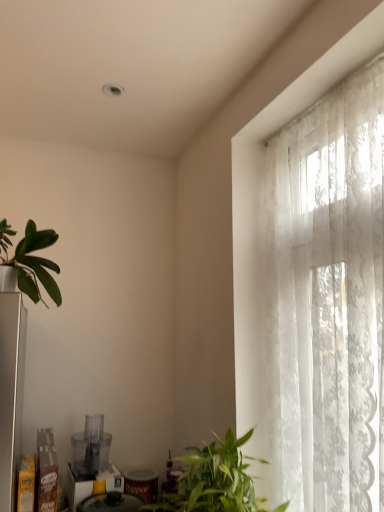
Question: Are matte plastic blender at lower left, which is the second appliance in top-to-bottom order, and transparent plastic food processor at lower left, which appears as the first appliance when viewed from the top, far apart?

Choices:
 (A) no
 (B) yes

Answer: (A)

Question: Can you confirm if matte plastic blender at lower left, which is the second appliance in top-to-bottom order, is wider than transparent plastic food processor at lower left, which is the 2th appliance in bottom-to-top order?

Choices:
 (A) no
 (B) yes

Answer: (B)

Question: Considering the relative positions of matte plastic blender at lower left, which is the second appliance in top-to-bottom order, and transparent plastic food processor at lower left, which is the 2th appliance in bottom-to-top order, in the image provided, is matte plastic blender at lower left, which is the second appliance in top-to-bottom order, behind transparent plastic food processor at lower left, which is the 2th appliance in bottom-to-top order,?

Choices:
 (A) yes
 (B) no

Answer: (B)

Question: From the image's perspective, does matte plastic blender at lower left, which is the second appliance in top-to-bottom order, appear lower than transparent plastic food processor at lower left, which appears as the first appliance when viewed from the top?

Choices:
 (A) no
 (B) yes

Answer: (B)

Question: Does matte plastic blender at lower left, the first appliance when ordered from bottom to top, have a lesser height compared to transparent plastic food processor at lower left, which is the 2th appliance in bottom-to-top order?

Choices:
 (A) no
 (B) yes

Answer: (B)

Question: Is matte plastic blender at lower left, the first appliance when ordered from bottom to top, outside transparent plastic food processor at lower left, which appears as the first appliance when viewed from the top?

Choices:
 (A) yes
 (B) no

Answer: (A)

Question: Considering the relative sizes of transparent plastic food processor at lower left, which appears as the first appliance when viewed from the top, and matte plastic blender at lower left, the first appliance when ordered from bottom to top, in the image provided, is transparent plastic food processor at lower left, which appears as the first appliance when viewed from the top, thinner than matte plastic blender at lower left, the first appliance when ordered from bottom to top,?

Choices:
 (A) yes
 (B) no

Answer: (A)

Question: Is transparent plastic food processor at lower left, which appears as the first appliance when viewed from the top, closer to camera compared to matte plastic blender at lower left, which is the second appliance in top-to-bottom order?

Choices:
 (A) no
 (B) yes

Answer: (A)

Question: Can you confirm if transparent plastic food processor at lower left, which appears as the first appliance when viewed from the top, is smaller than matte plastic blender at lower left, the first appliance when ordered from bottom to top?

Choices:
 (A) yes
 (B) no

Answer: (A)

Question: From the image's perspective, is transparent plastic food processor at lower left, which appears as the first appliance when viewed from the top, located beneath matte plastic blender at lower left, which is the second appliance in top-to-bottom order?

Choices:
 (A) yes
 (B) no

Answer: (B)

Question: Is transparent plastic food processor at lower left, which is the 2th appliance in bottom-to-top order, taller than matte plastic blender at lower left, the first appliance when ordered from bottom to top?

Choices:
 (A) yes
 (B) no

Answer: (A)

Question: Could matte plastic blender at lower left, the first appliance when ordered from bottom to top, be considered to be inside transparent plastic food processor at lower left, which appears as the first appliance when viewed from the top?

Choices:
 (A) yes
 (B) no

Answer: (B)

Question: Does green matte plant at left, the second houseplant when ordered from front to back, lie behind white lace curtain at right?

Choices:
 (A) no
 (B) yes

Answer: (B)